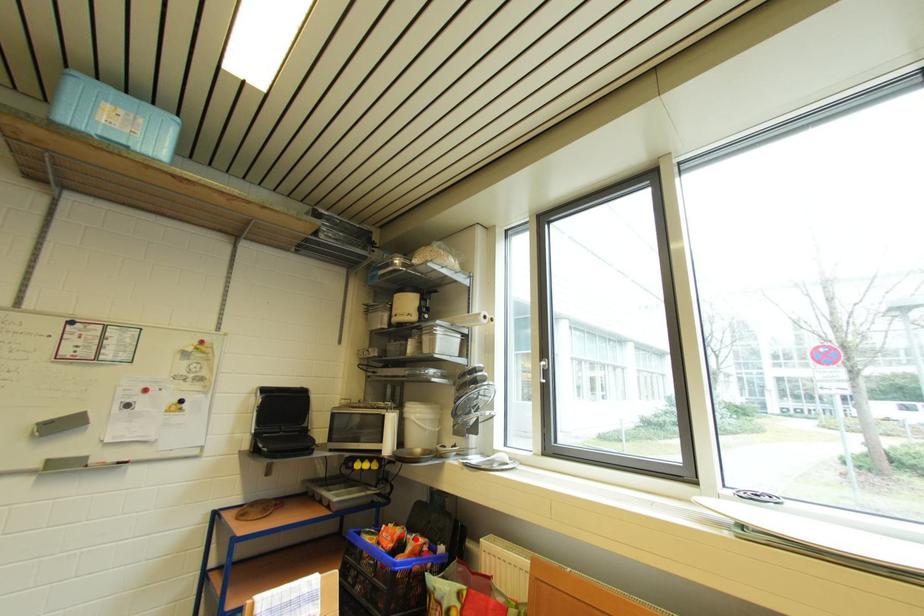
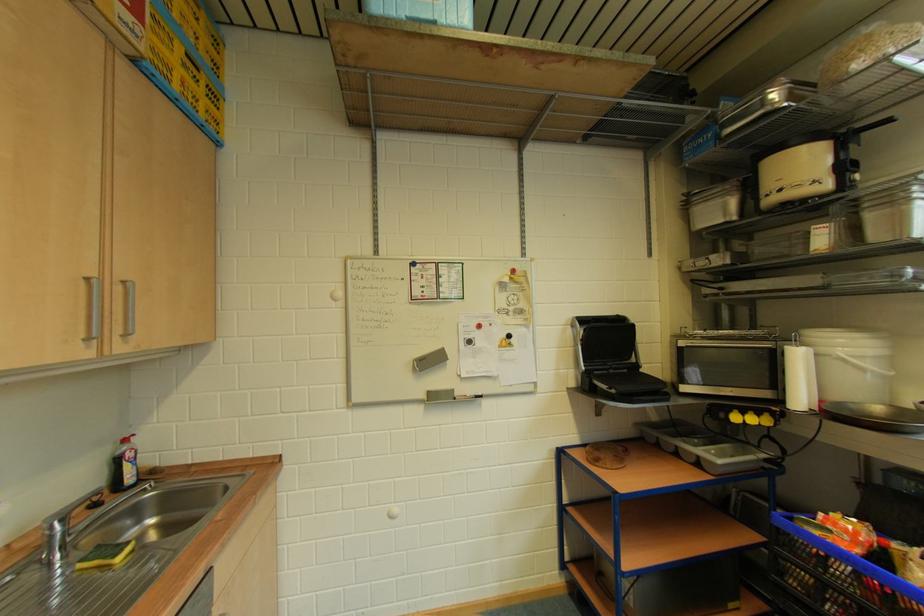
Locate, in the second image, the point that corresponds to the highlighted location in the first image.

(905, 549)